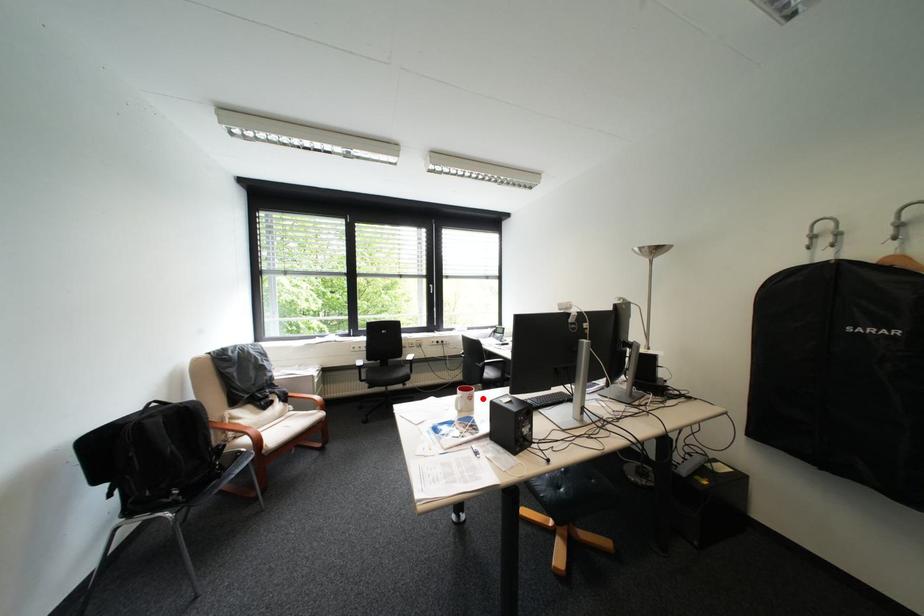
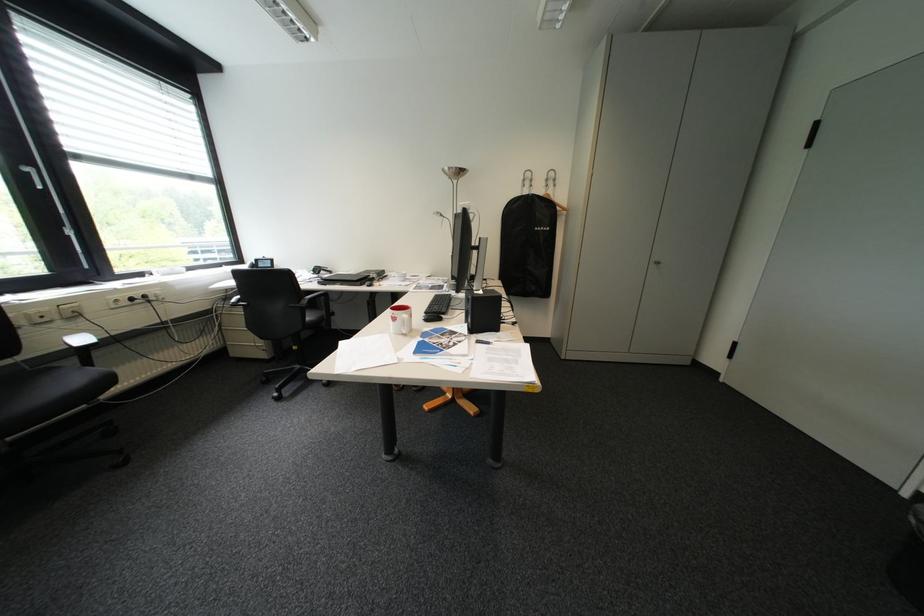
Where in the second image is the point corresponding to the highlighted location from the first image?

(423, 315)